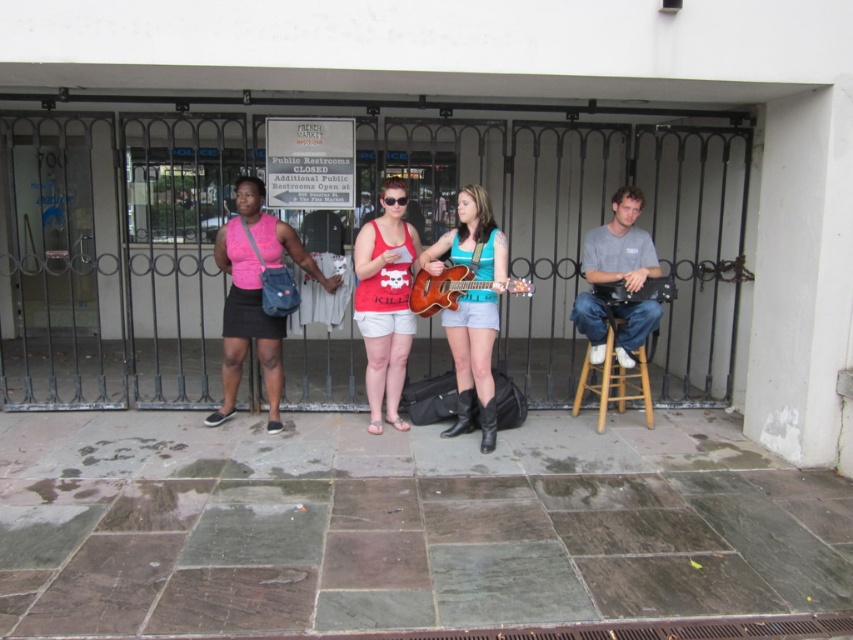
You are a fashion designer observing the group of people in the street scene. You notice the pink fabric skirt at center and the matte red tank top at center. Which clothing item is positioned to the left of the other?

The pink fabric skirt at center is to the left of the matte red tank top at center.

You are a street performer who has just finished a gig and needs to secure your belongings. You have a brown wooden guitar at center and transparent plastic goggles at center. Which item should you put into your bag first if you want to place the taller item first?

The brown wooden guitar at center is much taller than the transparent plastic goggles at center, so you should put the brown wooden guitar at center into your bag first.